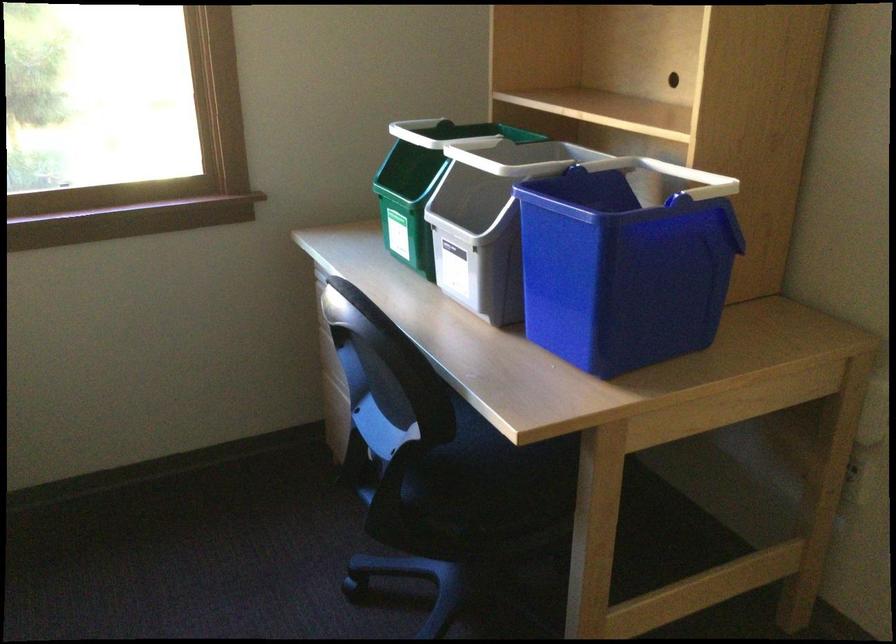
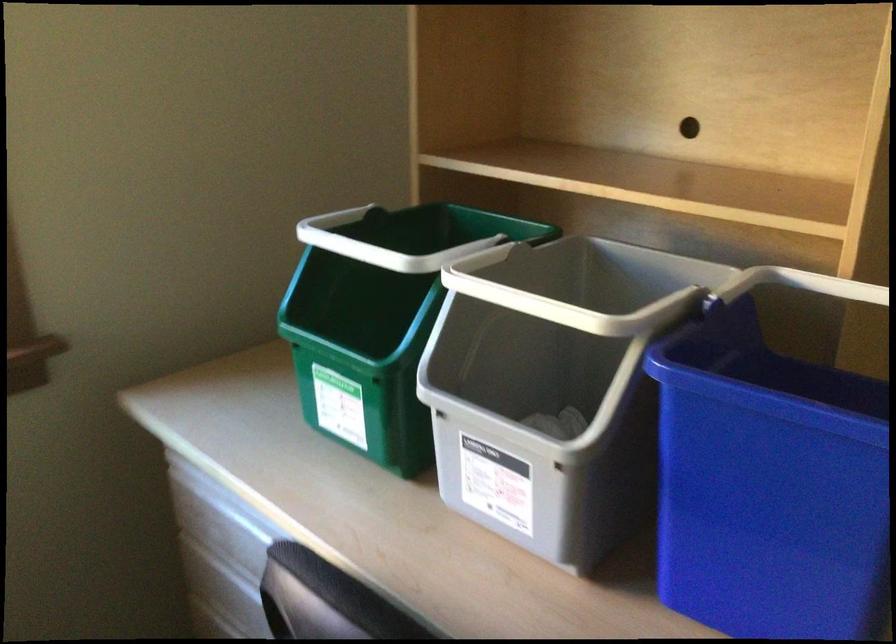
Question: The camera is either moving clockwise (left) or counter-clockwise (right) around the object. The first image is from the beginning of the video and the second image is from the end. Is the camera moving left or right when shooting the video?

Choices:
 (A) Left
 (B) Right

Answer: (A)